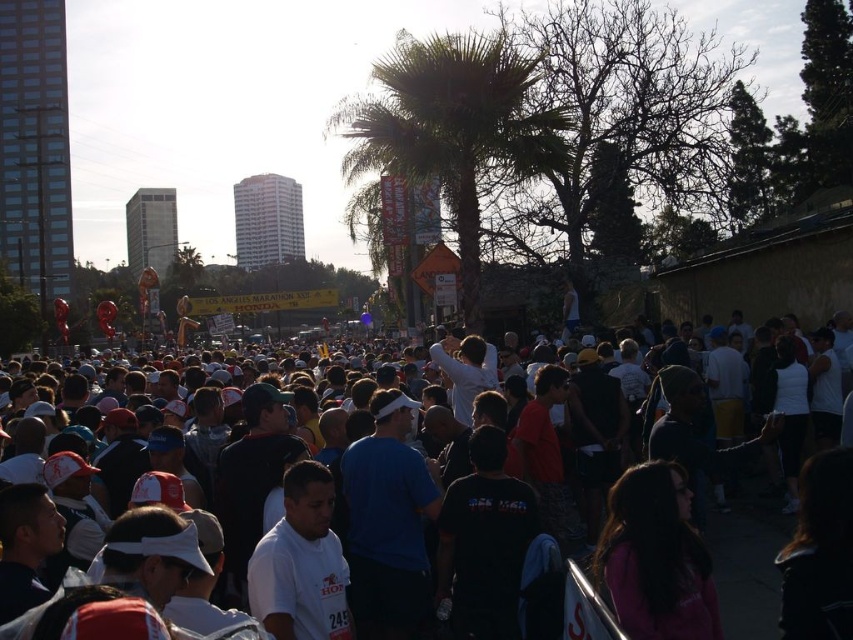
From the picture: You are a photographer at the Los Angeles Marathon trying to capture a photo of the green leafy palm tree at center without the white cotton crowd at center blocking it. Is the palm tree narrow enough to fit in the frame without the crowd overlapping?

The green leafy palm tree at center has a lesser width compared to the white cotton crowd at center, so it might be possible to position the camera to capture the palm tree without the crowd overlapping, as the tree is narrower.

You are a photographer trying to capture a photo of the marathon participants. You notice the green leafy palm tree at center and the white cotton crowd at center in your viewfinder. Which object is positioned higher in the frame?

The green leafy palm tree at center is positioned higher in the frame than the white cotton crowd at center because it is above the crowd.